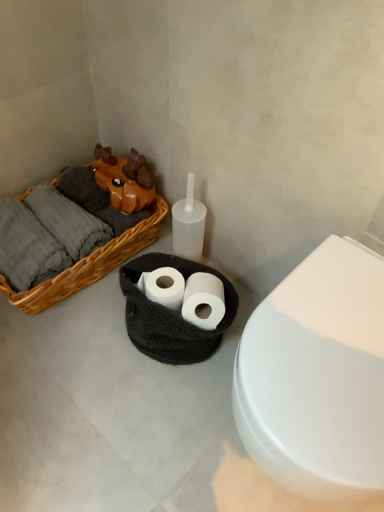
Question: Does woven wood basket at left touch white paper at center, placed as the second toilet paper when sorted from left to right?

Choices:
 (A) no
 (B) yes

Answer: (A)

Question: Does woven wood basket at left appear on the right side of white paper at center, which is the first toilet paper in right-to-left order?

Choices:
 (A) yes
 (B) no

Answer: (B)

Question: Is woven wood basket at left positioned beyond the bounds of white paper at center, placed as the second toilet paper when sorted from left to right?

Choices:
 (A) no
 (B) yes

Answer: (B)

Question: Could you tell me if woven wood basket at left is turned towards white paper at center, placed as the second toilet paper when sorted from left to right?

Choices:
 (A) yes
 (B) no

Answer: (B)

Question: Is woven wood basket at left oriented away from white paper at center, placed as the second toilet paper when sorted from left to right?

Choices:
 (A) no
 (B) yes

Answer: (A)

Question: From the image's perspective, relative to white matte toilet paper at center, placed as the second toilet paper when sorted from right to left, is white paper at center, placed as the second toilet paper when sorted from left to right, above or below?

Choices:
 (A) above
 (B) below

Answer: (B)

Question: In terms of height, does white paper at center, which is the first toilet paper in right-to-left order, look taller or shorter compared to white matte toilet paper at center, which appears as the first toilet paper when viewed from the left?

Choices:
 (A) tall
 (B) short

Answer: (A)

Question: Considering the positions of point (208, 301) and point (157, 301), is point (208, 301) closer or farther from the camera than point (157, 301)?

Choices:
 (A) farther
 (B) closer

Answer: (B)

Question: In the image, is white paper at center, which is the first toilet paper in right-to-left order, positioned in front of or behind white matte toilet paper at center, which appears as the first toilet paper when viewed from the left?

Choices:
 (A) behind
 (B) front

Answer: (B)

Question: In terms of width, does black crocheted basket at center look wider or thinner when compared to white glossy toilet at center right?

Choices:
 (A) wide
 (B) thin

Answer: (B)

Question: From the image's perspective, is black crocheted basket at center above or below white glossy toilet at center right?

Choices:
 (A) above
 (B) below

Answer: (A)

Question: In terms of height, does black crocheted basket at center look taller or shorter compared to white glossy toilet at center right?

Choices:
 (A) tall
 (B) short

Answer: (B)

Question: Considering the relative positions of black crocheted basket at center and white glossy toilet at center right in the image provided, is black crocheted basket at center to the left or to the right of white glossy toilet at center right?

Choices:
 (A) right
 (B) left

Answer: (B)

Question: In terms of size, does white paper at center, which is the first toilet paper in right-to-left order, appear bigger or smaller than black crocheted basket at center?

Choices:
 (A) small
 (B) big

Answer: (A)

Question: In the image, is white paper at center, which is the first toilet paper in right-to-left order, positioned in front of or behind black crocheted basket at center?

Choices:
 (A) front
 (B) behind

Answer: (B)